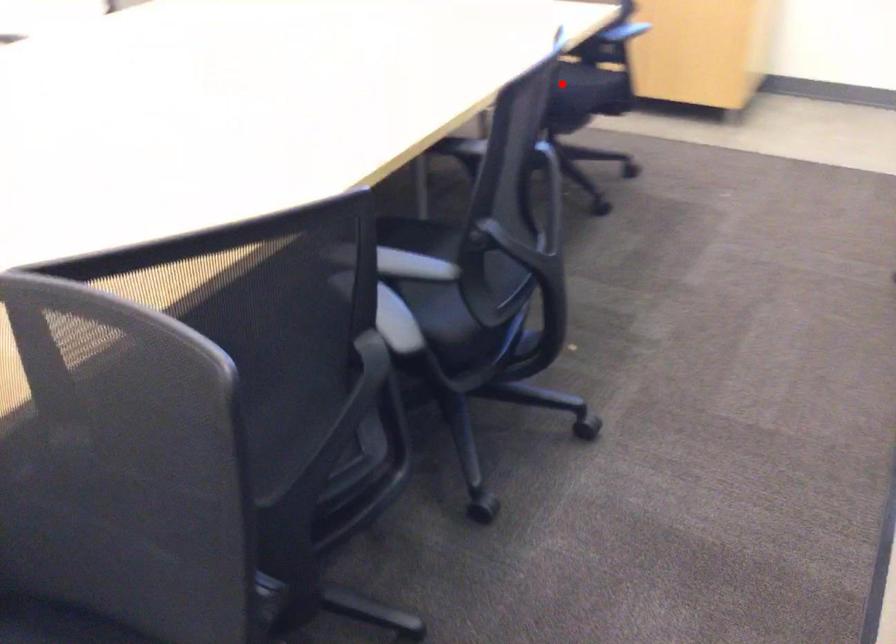
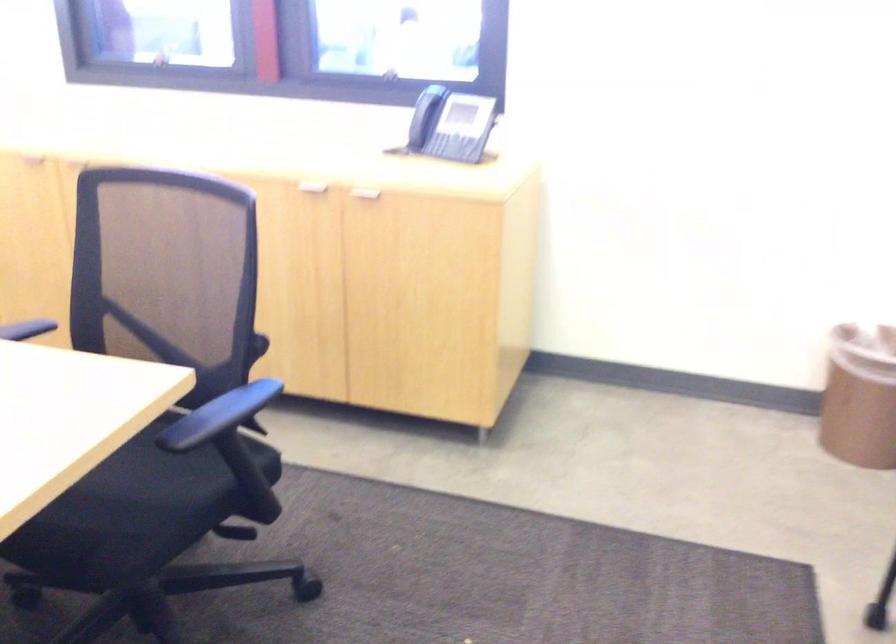
In the second image, find the point that corresponds to the highlighted location in the first image.

(124, 498)